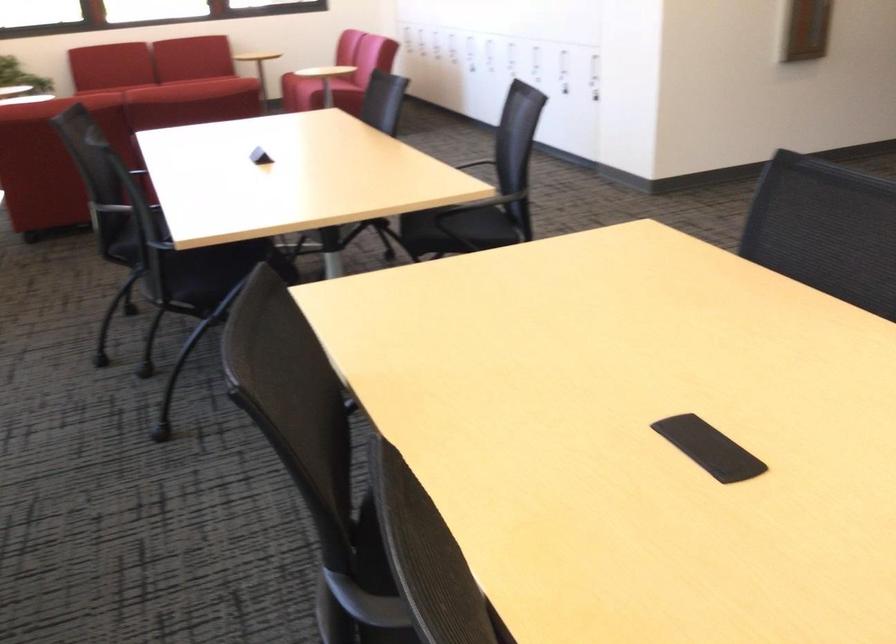
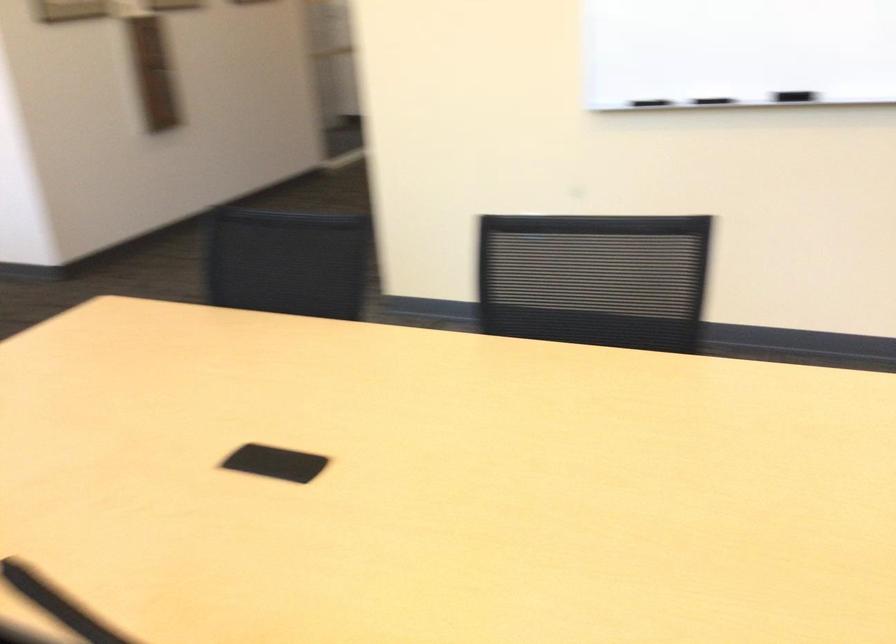
Question: How did the camera likely rotate?

Choices:
 (A) Left
 (B) Right
 (C) Up
 (D) Down

Answer: (B)